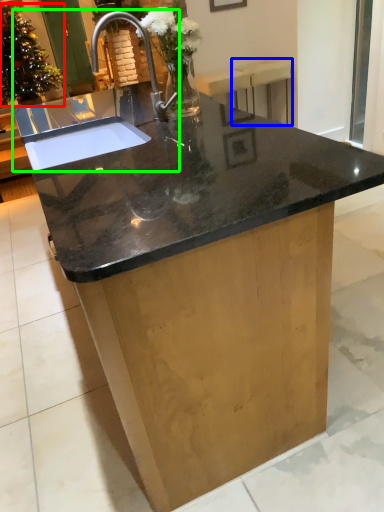
Question: Which object is positioned closest to floral arrangement (highlighted by a red box)? Select from bar stool (highlighted by a blue box) and sink (highlighted by a green box).

Choices:
 (A) bar stool
 (B) sink

Answer: (A)